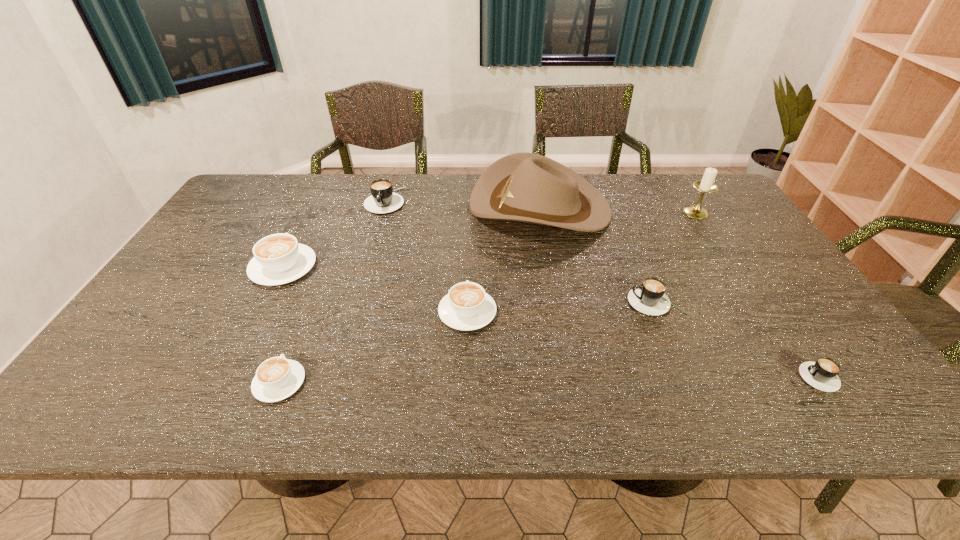
Identify the location of free point that satisfies the following two spatial constraints: 1. with a star on the front of the white candle holder; 2. on the right side of the cowboy hat. (540, 212).

The image size is (960, 540). In order to click on vacant area in the image that satisfies the following two spatial constraints: 1. on the side of the candle holder with the handle; 2. on the left side of the smallest white cappuccino in this screenshot , I will do `click(348, 212)`.